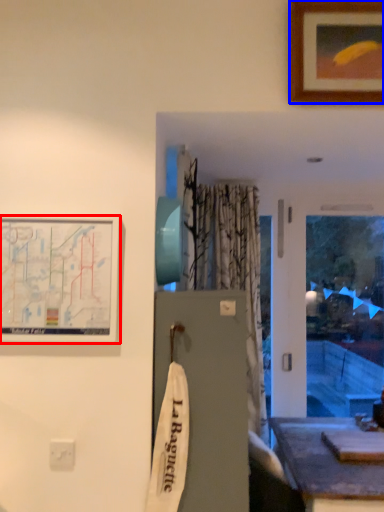
Question: Among these objects, which one is nearest to the camera, picture frame (highlighted by a red box) or picture frame (highlighted by a blue box)?

Choices:
 (A) picture frame
 (B) picture frame

Answer: (A)